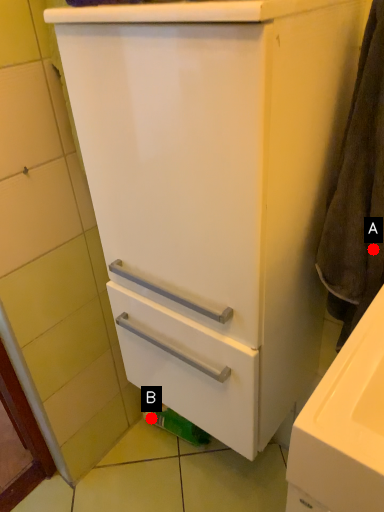
Question: Two points are circled on the image, labeled by A and B beside each circle. Which of the following is the farthest from the observer?

Choices:
 (A) A is further
 (B) B is further

Answer: (B)